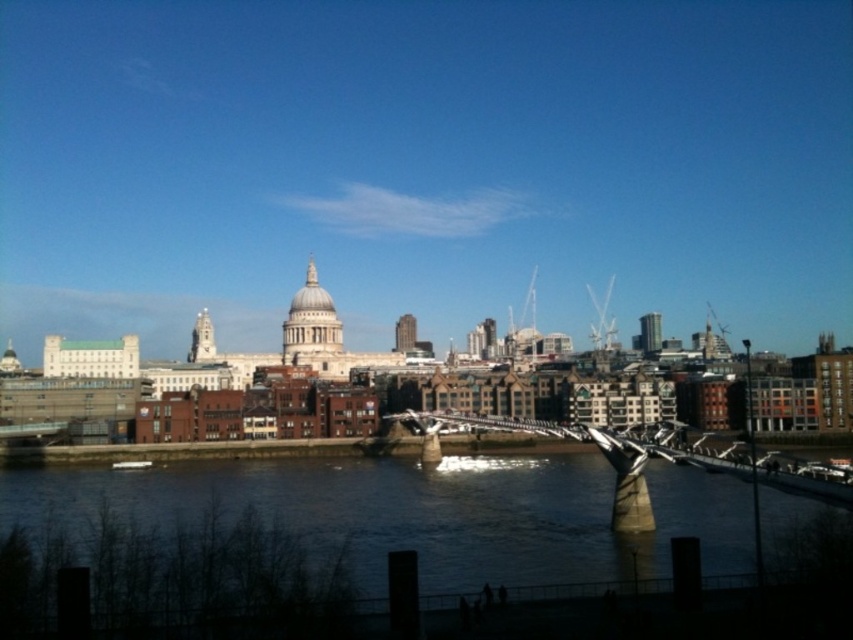
You are a city planner assessing the Millennium Bridge for maintenance. From the image, which object, the dark water at center or the metallic silver bridge at center, has a greater width?

The dark water at center has a greater width than the metallic silver bridge at center according to the description.

You are standing at the Millennium Bridge in the city. You want to take a photo of the point at coordinates point (521, 579). Your camera has a maximum zoom range of 100 meters. Can you capture the point in your photo without moving?

The distance between you and the point (521, 579) is 78.17 meters, which is within your camera maximum zoom range of 100 meters. Therefore, you can capture the point in your photo without moving.

You are a photographer planning to capture the entire Millennium Bridge and the dome of St. Paul Cathedral in a single frame. Considering the dark water at center and the metallic silver bridge at center, which object should you focus on to ensure both landmarks are fully visible?

The dark water at center has a larger size compared to the metallic silver bridge at center. To ensure both landmarks are fully visible, focus on the dark water at center as it occupies more space, allowing the bridge and the dome to be captured within the frame.